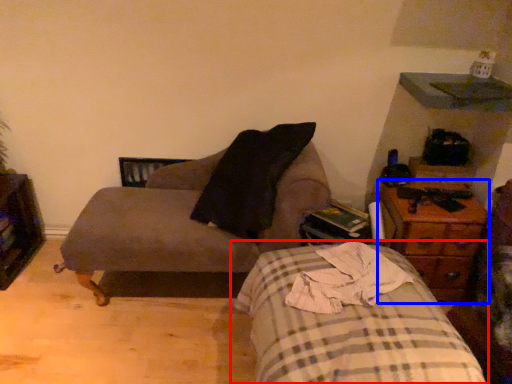
Question: Which object appears closest to the camera in this image, bed (highlighted by a red box) or nightstand (highlighted by a blue box)?

Choices:
 (A) bed
 (B) nightstand

Answer: (A)